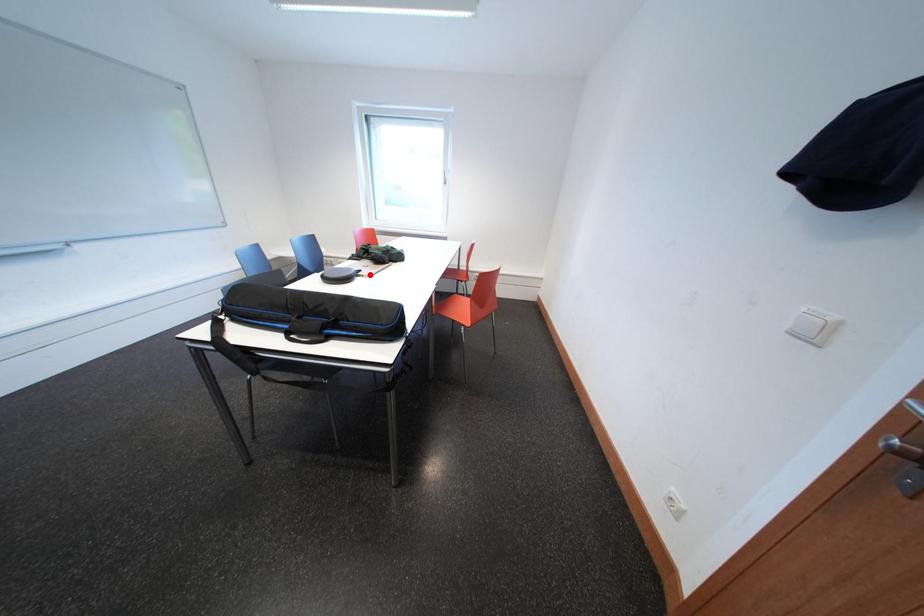
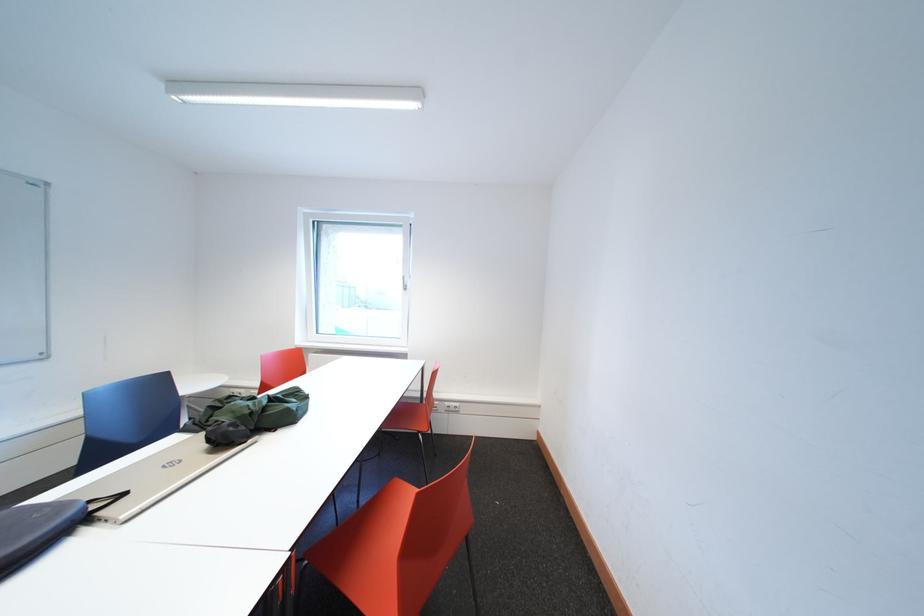
Question: I am providing you with two images of the same scene from different viewpoints. A red point is marked on the first image. At the location where the point appears in image 1, is it still visible in image 2?

Choices:
 (A) Yes
 (B) No

Answer: (A)